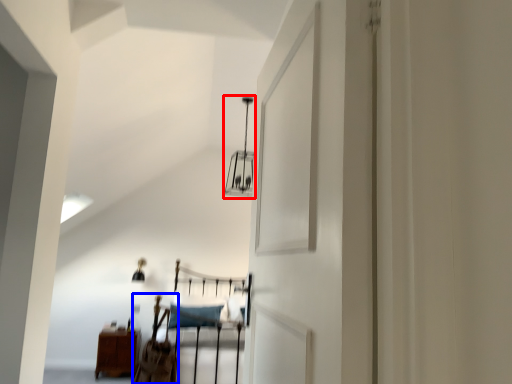
Question: Which point is closer to the camera, light fixture (highlighted by a red box) or chair (highlighted by a blue box)?

Choices:
 (A) light fixture
 (B) chair

Answer: (B)